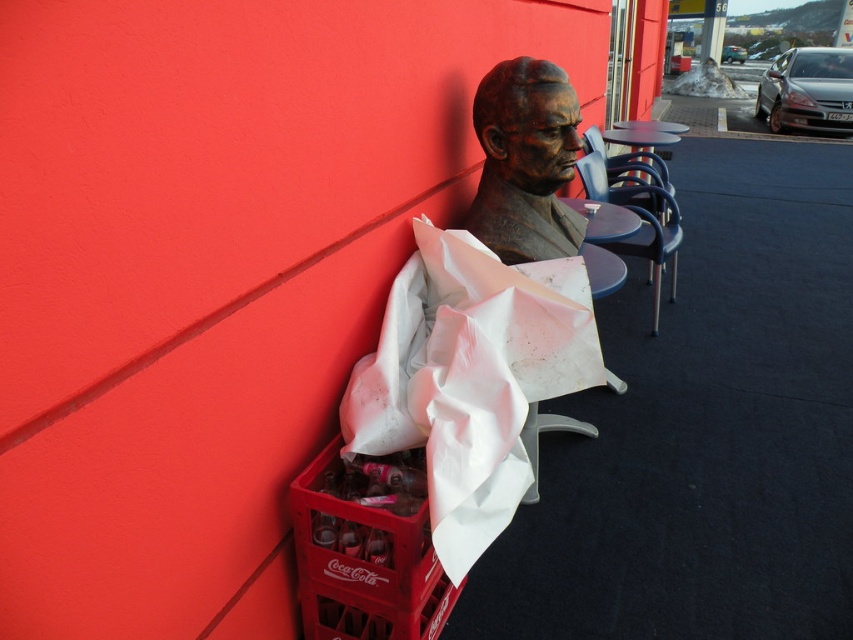
Question: Does bronze bust at center have a lesser width compared to metallic blue table at center?

Choices:
 (A) yes
 (B) no

Answer: (A)

Question: Which object appears closest to the camera in this image?

Choices:
 (A) metallic blue table at center
 (B) white plastic table at center

Answer: (B)

Question: Which of these objects is positioned farthest from the metallic blue chair at center?

Choices:
 (A) bronze bust at center
 (B) metallic blue table at center
 (C) red plastic crate at lower left

Answer: (C)

Question: Is red plastic crate at lower left thinner than metallic blue chair at center?

Choices:
 (A) yes
 (B) no

Answer: (A)

Question: Observing the image, what is the correct spatial positioning of metallic blue chair at center in reference to white plastic table at center?

Choices:
 (A) below
 (B) above

Answer: (B)

Question: Based on their relative distances, which object is farther from the metallic blue chair at center?

Choices:
 (A) metallic blue table at center
 (B) bronze bust at center
 (C) white plastic table at center

Answer: (B)